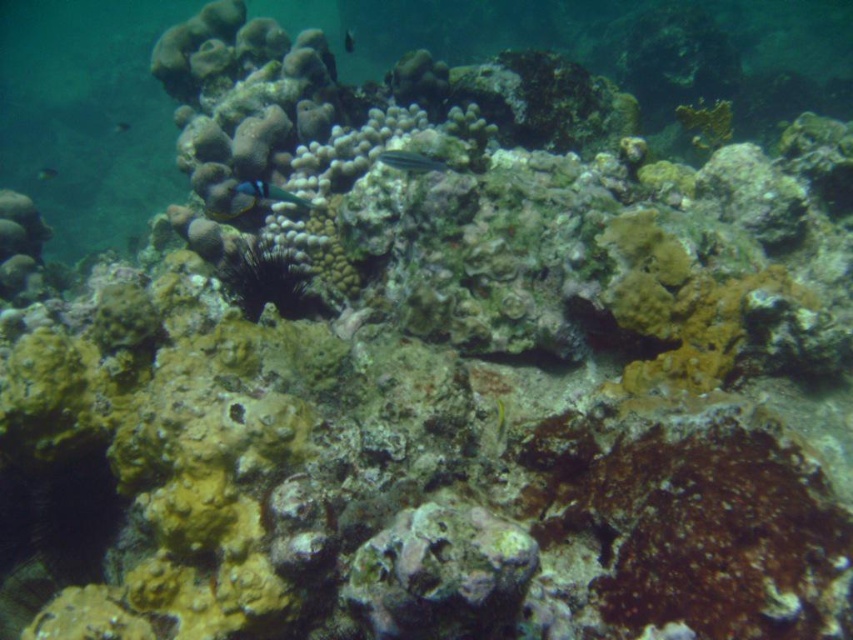
You are a marine biologist observing an underwater coral reef. You notice two fish in the scene. The first is a blue glossy fish at center, and the second is a shiny blue fish at upper center. Which fish is positioned to the right of the other?

The blue glossy fish at center is positioned to the right of the shiny blue fish at upper center.

You are a marine biologist observing an underwater coral reef scene. You notice two fish species present in the image. The first is a green striped fish at center, and the second is a blue glossy fish at center. Based on their positions, which fish is closer to the surface of the water?

The green striped fish at center is located above the blue glossy fish at center, meaning it is closer to the surface of the water.